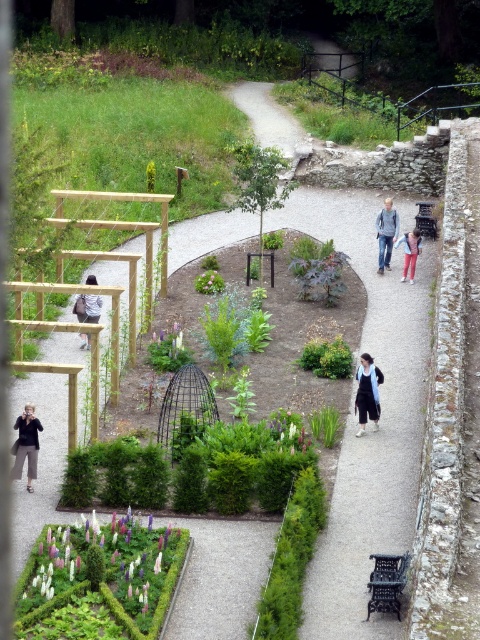
You are standing at the elevated viewpoint overlooking the garden. There are two points marked in the garden, one at coordinates point (x=276, y=602) and the other at point (x=33, y=477). Which point is closer to your current position?

Point (x=276, y=602) is closer to the viewer than point (x=33, y=477).